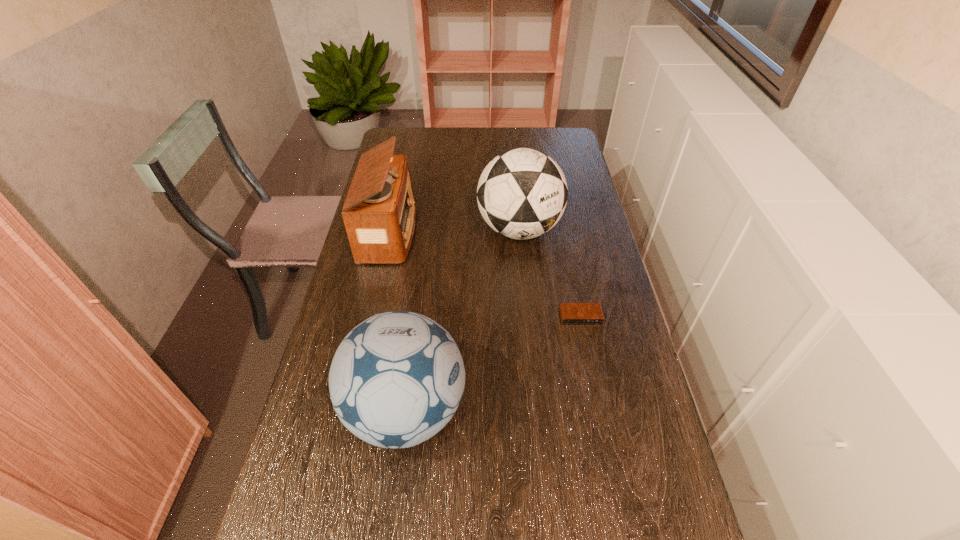
Identify the location of the farther soccer ball. This screenshot has width=960, height=540. (522, 193).

Locate an element on the screen. This screenshot has height=540, width=960. the nearest object is located at coordinates (397, 378).

Find the location of a particular element. the left soccer ball is located at coordinates (397, 378).

You are a GUI agent. You are given a task and a screenshot of the screen. Output one action in this format:
    pyautogui.click(x=<x>, y=<y>)
    Task: Click on the radio receiver
    
    Given the screenshot: What is the action you would take?
    pyautogui.click(x=379, y=213)

Where is `alarm clock`? The image size is (960, 540). alarm clock is located at coordinates (570, 313).

Image resolution: width=960 pixels, height=540 pixels. What are the coordinates of `the third farthest object` in the screenshot? It's located at (570, 313).

In order to click on free region located 0.140m on the surface of the right soccer ball where the brand logo is visible in this screenshot , I will do `click(525, 291)`.

I want to click on free spot located on the side with brand of the nearer soccer ball, so click(506, 410).

The width and height of the screenshot is (960, 540). Identify the location of vacant space located on the front panel of the radio receiver. (490, 232).

Where is `vacant region located on the front face of the shortest object`? This screenshot has width=960, height=540. vacant region located on the front face of the shortest object is located at coordinates (593, 381).